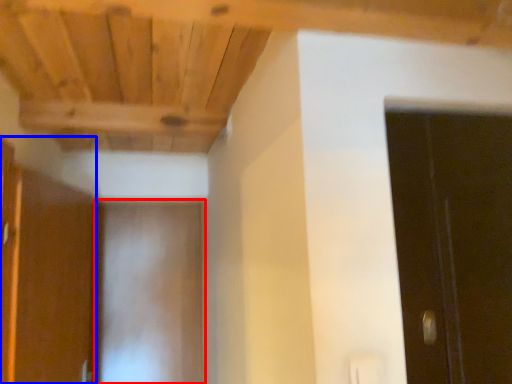
Question: Among these objects, which one is nearest to the camera, door (highlighted by a red box) or cabinetry (highlighted by a blue box)?

Choices:
 (A) door
 (B) cabinetry

Answer: (B)